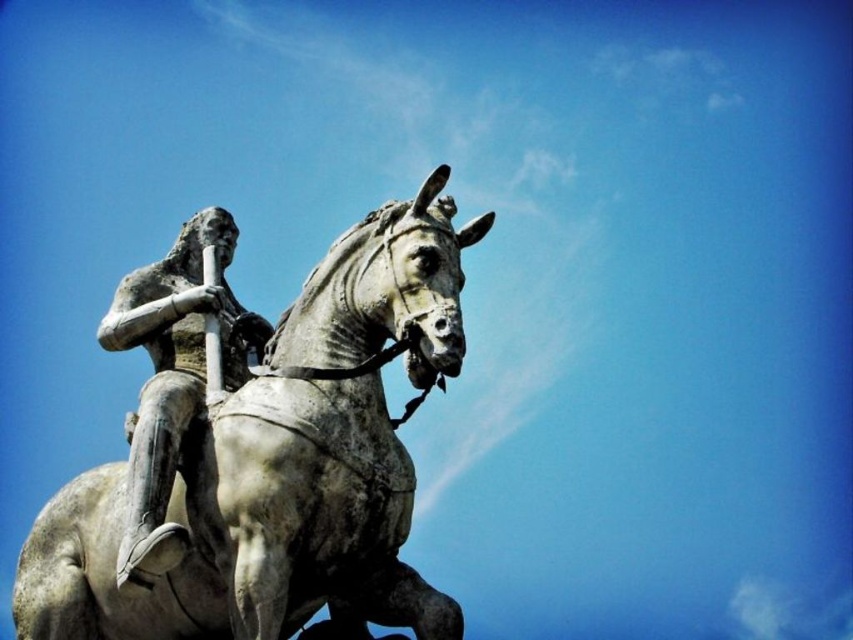
You are a tour guide explaining the mounted statue to visitors. You want to mention the positioning of the bronze statue at center and the gray stone horse at center. How are they arranged in relation to each other?

The bronze statue at center is positioned behind the gray stone horse at center, creating a layered visual composition that highlights both elements within the statue.

You are an art student analyzing the statue of the mounted figure. You notice the gray stone horse at center and the bronze statue at center. Which part of the mounted figure is taller?

The gray stone horse at center is much taller than the bronze statue at center.

You are an artist trying to sketch the scene. You need to place the gray stone horse at center in your drawing. According to the scene description, where should you position it on the 2D grid?

The gray stone horse at center should be positioned at the coordinates point (287, 465) on the 2D grid.